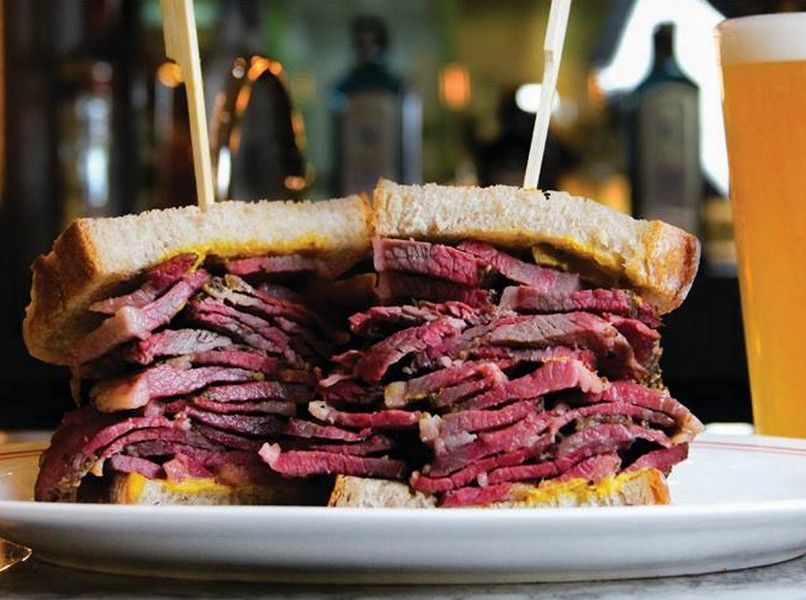
This screenshot has height=600, width=806. Find the location of `liquor bottles`. liquor bottles is located at coordinates (366, 118), (665, 135).